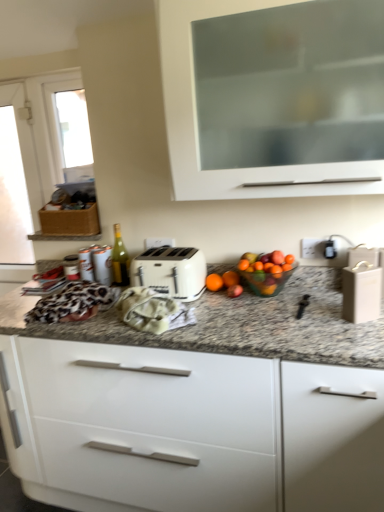
Question: From a real-world perspective, does white plastic toaster at center stand above beige matte wine box at right, which ranks as the 2th appliance in left-to-right order?

Choices:
 (A) no
 (B) yes

Answer: (A)

Question: Is white plastic toaster at center behind beige matte wine box at right, the second appliance viewed from the back?

Choices:
 (A) yes
 (B) no

Answer: (A)

Question: Is white plastic toaster at center positioned far away from beige matte wine box at right, positioned as the first appliance in right-to-left order?

Choices:
 (A) no
 (B) yes

Answer: (A)

Question: Is white plastic toaster at center at the left side of beige matte wine box at right, positioned as the first appliance in right-to-left order?

Choices:
 (A) no
 (B) yes

Answer: (B)

Question: Does white plastic toaster at center appear on the right side of beige matte wine box at right, positioned as the first appliance in right-to-left order?

Choices:
 (A) yes
 (B) no

Answer: (B)

Question: Considering the relative sizes of white plastic toaster at center and beige matte wine box at right, the 1th appliance viewed from the front, in the image provided, is white plastic toaster at center taller than beige matte wine box at right, the 1th appliance viewed from the front,?

Choices:
 (A) no
 (B) yes

Answer: (A)

Question: From the image's perspective, would you say metallic silver canister at left, which is the 1th appliance in back-to-front order, is positioned over green glass bottle at center?

Choices:
 (A) yes
 (B) no

Answer: (B)

Question: Considering the relative sizes of metallic silver canister at left, which appears as the first appliance when viewed from the left, and green glass bottle at center in the image provided, is metallic silver canister at left, which appears as the first appliance when viewed from the left, taller than green glass bottle at center?

Choices:
 (A) no
 (B) yes

Answer: (A)

Question: Is there a large distance between metallic silver canister at left, arranged as the 2th appliance when viewed from the front, and green glass bottle at center?

Choices:
 (A) yes
 (B) no

Answer: (B)

Question: From a real-world perspective, does metallic silver canister at left, arranged as the 2th appliance when viewed from the front, stand above green glass bottle at center?

Choices:
 (A) yes
 (B) no

Answer: (B)

Question: Is metallic silver canister at left, which appears as the 2th appliance when viewed from the right, further to the viewer compared to green glass bottle at center?

Choices:
 (A) yes
 (B) no

Answer: (B)

Question: Does metallic silver canister at left, which is the 1th appliance in back-to-front order, appear on the right side of green glass bottle at center?

Choices:
 (A) no
 (B) yes

Answer: (A)

Question: Does white glossy cabinet at center, which is counted as the second cabinetry, starting from the top, have a lesser width compared to beige matte wine box at right, the 1th appliance viewed from the front?

Choices:
 (A) yes
 (B) no

Answer: (B)